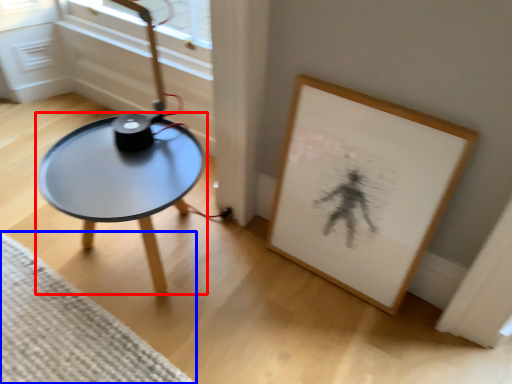
Question: Which of the following is the farthest to the observer, coffee table (highlighted by a red box) or mat (highlighted by a blue box)?

Choices:
 (A) coffee table
 (B) mat

Answer: (A)